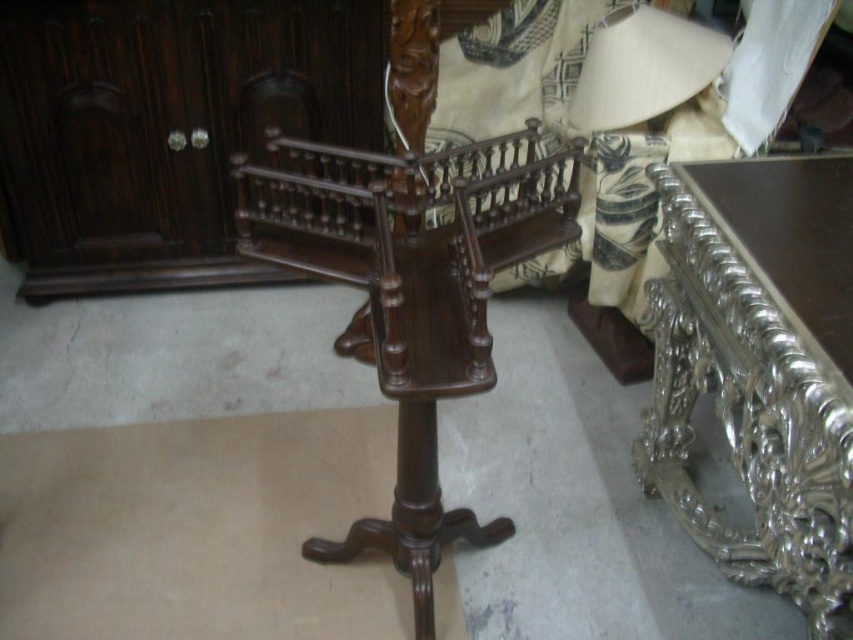
You are arranging a small potted plant between the silver metallic table at right and the polished dark wood coat rack at center. If the plant needs 12 inches of space to grow comfortably, will there be enough space between them?

The silver metallic table at right is 18.32 inches away from the polished dark wood coat rack at center, which is more than the required 12 inches. Therefore, there is enough space for the plant to grow comfortably between them.

You are organizing a space and need to place a new decorative item on the highest point between the silver metallic table at right and the polished dark wood coat rack at center. Which object should you choose to place it on?

The polished dark wood coat rack at center is higher than the silver metallic table at right, so you should place the decorative item on the polished dark wood coat rack at center.